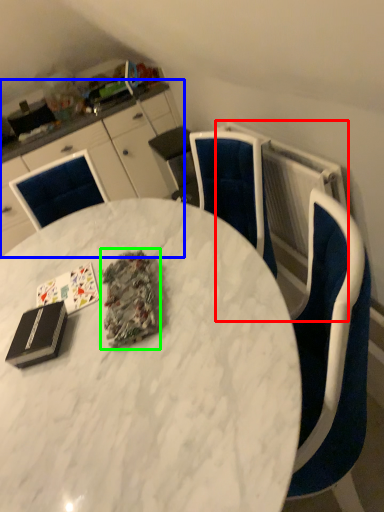
Question: Considering the real-world distances, which object is closest to radiator (highlighted by a red box)? cabinetry (highlighted by a blue box) or debris (highlighted by a green box).

Choices:
 (A) cabinetry
 (B) debris

Answer: (B)